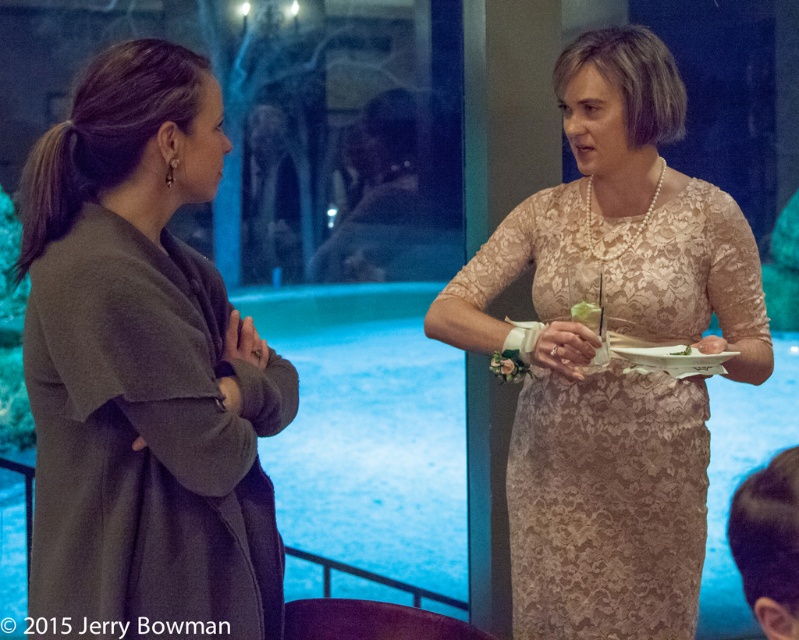
Is dark gray wool coat at left to the left of lace dress at center from the viewer's perspective?

Indeed, dark gray wool coat at left is positioned on the left side of lace dress at center.

Does dark gray wool coat at left have a larger size compared to lace dress at center?

No.

Which is in front, point (277, 586) or point (519, 212)?

Positioned in front is point (277, 586).

Locate an element on the screen. dark gray wool coat at left is located at coordinates (142, 371).

Which is in front, point (132, 326) or point (583, 317)?

Positioned in front is point (132, 326).

Which of these two, dark gray wool coat at left or green leafy vegetable at center, stands shorter?

green leafy vegetable at center

This screenshot has width=799, height=640. What do you see at coordinates (142, 371) in the screenshot? I see `dark gray wool coat at left` at bounding box center [142, 371].

Locate an element on the screen. dark gray wool coat at left is located at coordinates (142, 371).

Is lace dress at center thinner than green leafy vegetable at center?

Incorrect, lace dress at center's width is not less than green leafy vegetable at center's.

Is point (450, 308) positioned after point (577, 317)?

Yes, it is.

Identify the location of lace dress at center. This screenshot has height=640, width=799. (610, 369).